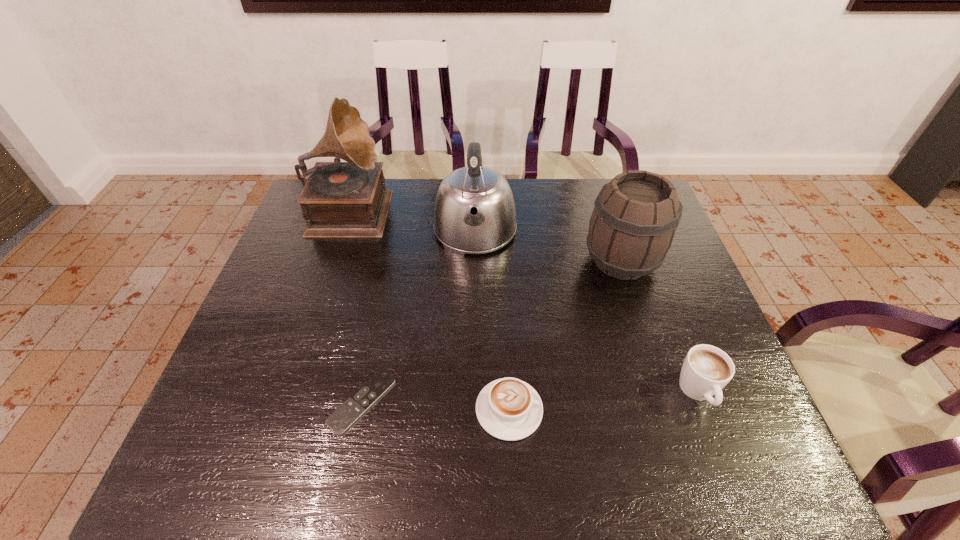
The height and width of the screenshot is (540, 960). Find the location of `free space between the shorter cappuccino and the remote control`. free space between the shorter cappuccino and the remote control is located at coordinates (436, 406).

Locate an element on the screen. free space between the tallest object and the kettle is located at coordinates (413, 219).

Locate an element on the screen. free space between the taller cappuccino and the kettle is located at coordinates (587, 312).

Locate an element on the screen. The image size is (960, 540). empty location between the kettle and the taller cappuccino is located at coordinates (587, 312).

Find the location of a particular element. The image size is (960, 540). free spot between the remote control and the third tallest object is located at coordinates (492, 331).

Locate an element on the screen. The image size is (960, 540). object that is the third closest one to the record player is located at coordinates (509, 409).

Choose which object is the second nearest neighbor to the kettle. Please provide its 2D coordinates. Your answer should be formatted as a tuple, i.e. [(x, y)], where the tuple contains the x and y coordinates of a point satisfying the conditions above.

[(632, 226)]

What are the coordinates of `vacant space that satisfies the following two spatial constraints: 1. on the spout of the kettle; 2. on the right side of the wine bucket` in the screenshot? It's located at (474, 261).

Where is `free space in the image that satisfies the following two spatial constraints: 1. on the spout of the kettle; 2. on the left side of the fourth shortest object`? free space in the image that satisfies the following two spatial constraints: 1. on the spout of the kettle; 2. on the left side of the fourth shortest object is located at coordinates (474, 261).

You are a GUI agent. You are given a task and a screenshot of the screen. Output one action in this format:
    pyautogui.click(x=<x>, y=<y>)
    Task: Click on the blank space that satisfies the following two spatial constraints: 1. from the horn of the remote control; 2. on the right side of the tallest object
    The height and width of the screenshot is (540, 960).
    Given the screenshot: What is the action you would take?
    pyautogui.click(x=286, y=402)